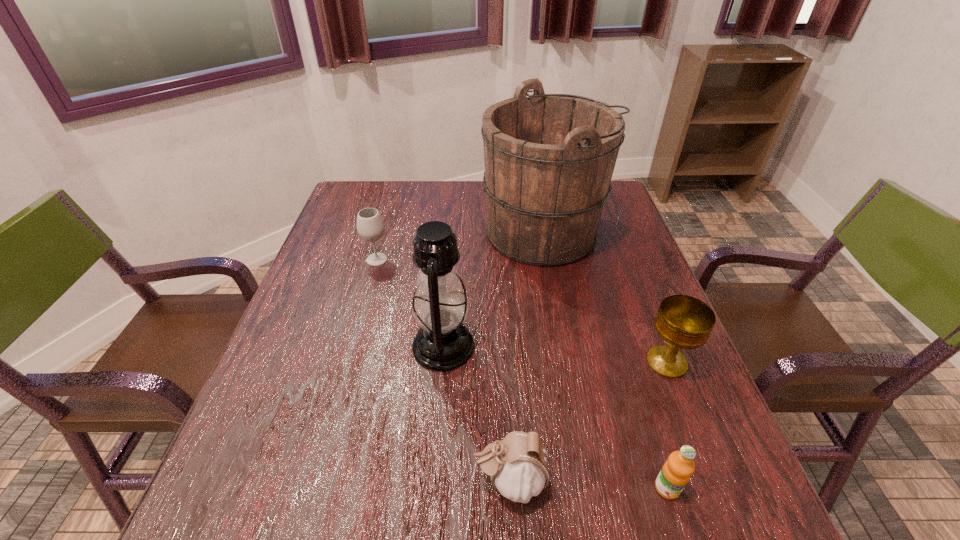
Select which object appears as the closest to the pouch. Please provide its 2D coordinates. Your answer should be formatted as a tuple, i.e. [(x, y)], where the tuple contains the x and y coordinates of a point satisfying the conditions above.

[(443, 343)]

Find the location of a particular element. object that is the fourth closest to the chalice is located at coordinates (443, 343).

I want to click on vacant region that satisfies the following two spatial constraints: 1. on the front side of the leftmost object; 2. on the right side of the chalice, so click(348, 362).

Find the location of `vacant position in the image that satisfies the following two spatial constraints: 1. on the front side of the bucket; 2. on the front-facing side of the pouch`. vacant position in the image that satisfies the following two spatial constraints: 1. on the front side of the bucket; 2. on the front-facing side of the pouch is located at coordinates (592, 481).